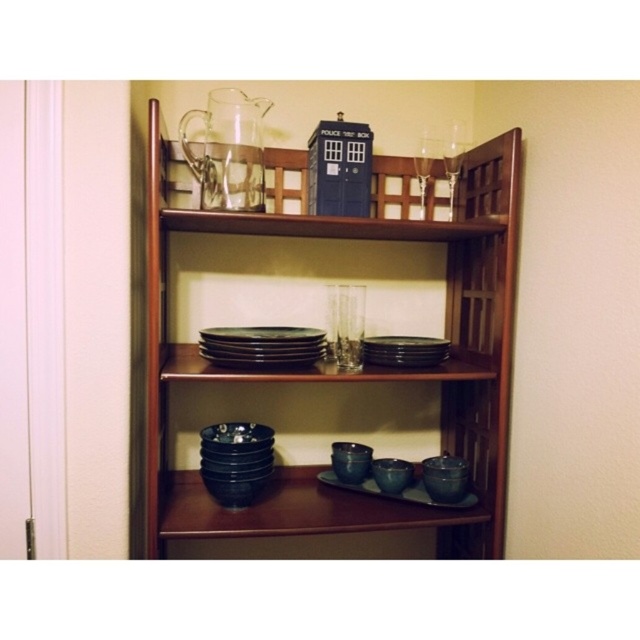
You are organizing a dinner party and need to place a new dessert platter on the shelf where the matte black platter at center is located. However, you notice the transparent glass wine glass at upper right is directly above it. Is there enough vertical space between the two shelves to safely place the new platter without it touching the wine glass?

The matte black platter at center is below the transparent glass wine glass at upper right, so there is sufficient vertical space between the shelves to place the new dessert platter without it touching the wine glass.

What object is located at the coordinates point (397, 492) in the image?

The point (397, 492) corresponds to the matte black platter at center.

You are organizing the shelves and want to place a new item that requires a stable base. Which object between the matte black platter at center and the transparent glass wine glass at upper right would be more suitable as a base?

The matte black platter at center has a lesser height compared to the transparent glass wine glass at upper right, making it more stable and suitable as a base.